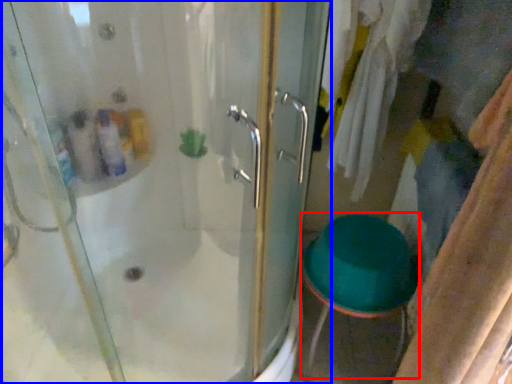
Question: Which of the following is the farthest to the observer, step stool (highlighted by a red box) or door (highlighted by a blue box)?

Choices:
 (A) step stool
 (B) door

Answer: (A)